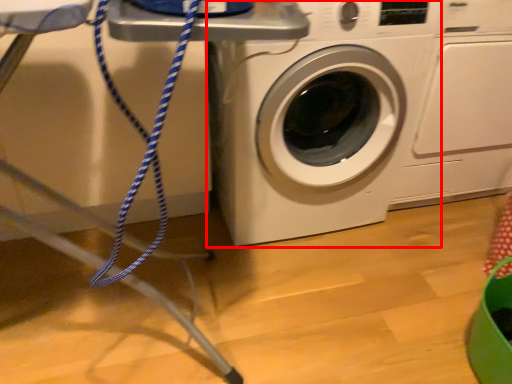
Question: From the image, what is the correct spatial relationship of washing machine (annotated by the red box) in relation to washing machine?

Choices:
 (A) right
 (B) left

Answer: (B)